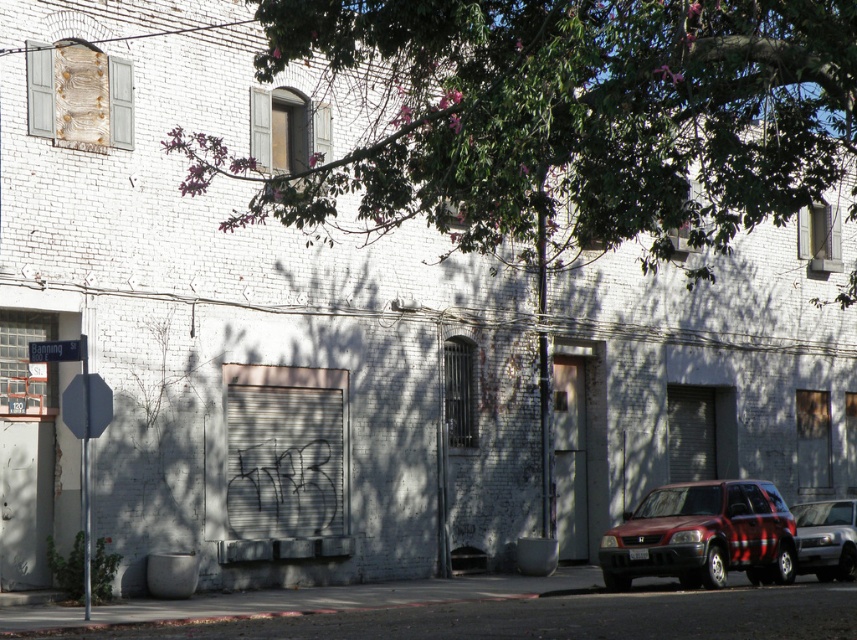
Question: Estimate the real-world distances between objects in this image. Which object is closer to the metallic blue street sign at left?

Choices:
 (A) matte red suv at lower right
 (B) green leafy tree at upper center

Answer: (B)

Question: Can you confirm if green leafy tree at upper center is thinner than silver metallic suv at lower right?

Choices:
 (A) yes
 (B) no

Answer: (B)

Question: From the image, what is the correct spatial relationship of green leafy tree at upper center in relation to metallic blue street sign at left?

Choices:
 (A) above
 (B) below

Answer: (A)

Question: Which of the following is the closest to the observer?

Choices:
 (A) (757, 504)
 (B) (621, 225)

Answer: (B)

Question: Based on their relative distances, which object is farther from the matte red suv at lower right?

Choices:
 (A) silver metallic suv at lower right
 (B) green leafy tree at upper center

Answer: (B)

Question: Does matte red suv at lower right appear under metallic blue street sign at left?

Choices:
 (A) no
 (B) yes

Answer: (B)